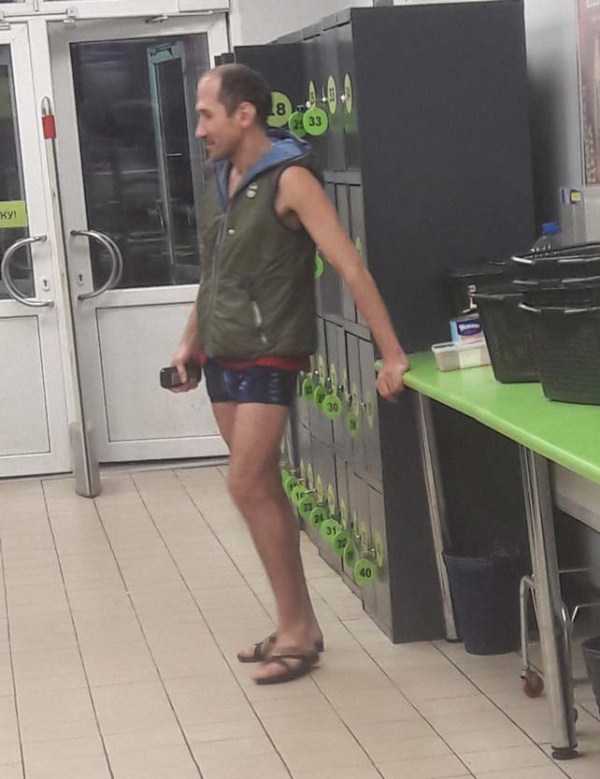
Image resolution: width=600 pixels, height=779 pixels. What are the coordinates of `door handle` in the screenshot? It's located at (113, 259), (8, 276).